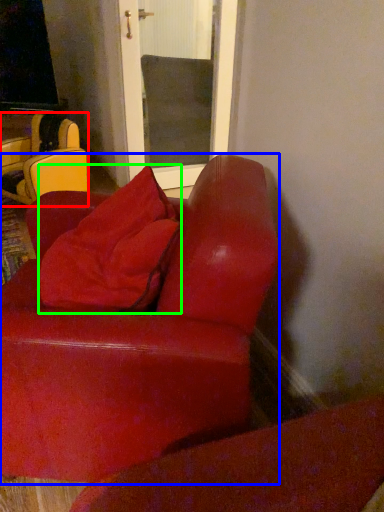
Question: Based on their relative distances, which object is farther from chair (highlighted by a red box)? Choose from studio couch (highlighted by a blue box) and throw pillow (highlighted by a green box).

Choices:
 (A) studio couch
 (B) throw pillow

Answer: (A)